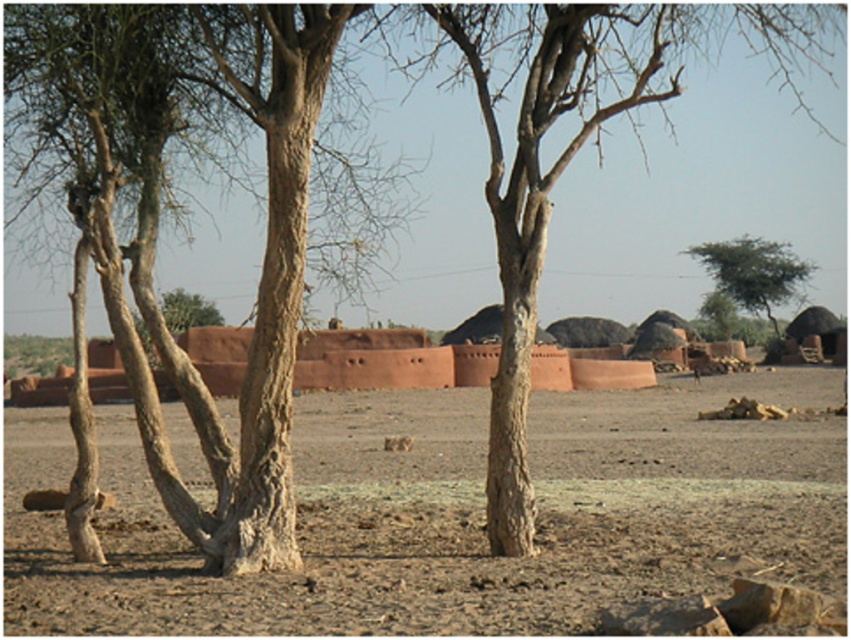
Who is taller, green leafy tree at upper right or brown rough tree trunk at center?

green leafy tree at upper right is taller.

Does green leafy tree at upper right appear on the left side of brown rough tree trunk at center?

In fact, green leafy tree at upper right is to the right of brown rough tree trunk at center.

Is point (810, 264) closer to camera compared to point (181, 332)?

No, (810, 264) is further to viewer.

This screenshot has width=851, height=640. Identify the location of green leafy tree at upper right. (752, 272).

Can you confirm if smooth bark tree at center is bigger than green leafy tree at upper right?

Yes.

Can you confirm if smooth bark tree at center is positioned to the right of green leafy tree at upper right?

No, smooth bark tree at center is not to the right of green leafy tree at upper right.

Which is behind, point (572, 67) or point (761, 282)?

Positioned behind is point (761, 282).

This screenshot has width=851, height=640. I want to click on smooth bark tree at center, so click(x=570, y=141).

Can you confirm if brown sandy dirt at center is positioned below green leafy tree at upper right?

Indeed, brown sandy dirt at center is positioned under green leafy tree at upper right.

Is brown sandy dirt at center taller than green leafy tree at upper right?

No, brown sandy dirt at center is not taller than green leafy tree at upper right.

The height and width of the screenshot is (640, 851). I want to click on brown sandy dirt at center, so click(455, 515).